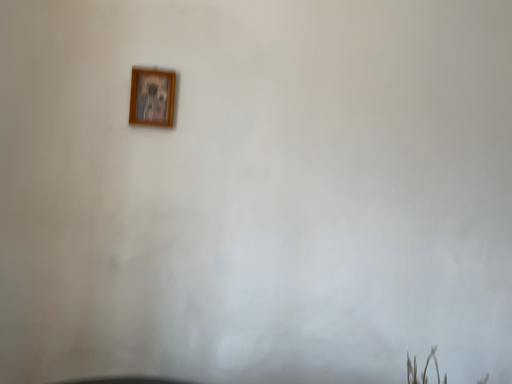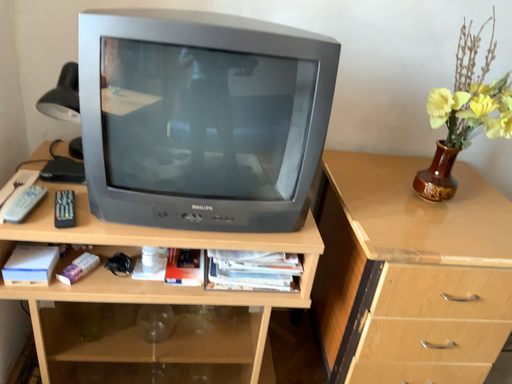
Question: How did the camera likely rotate when shooting the video?

Choices:
 (A) rotated upward
 (B) rotated downward

Answer: (B)